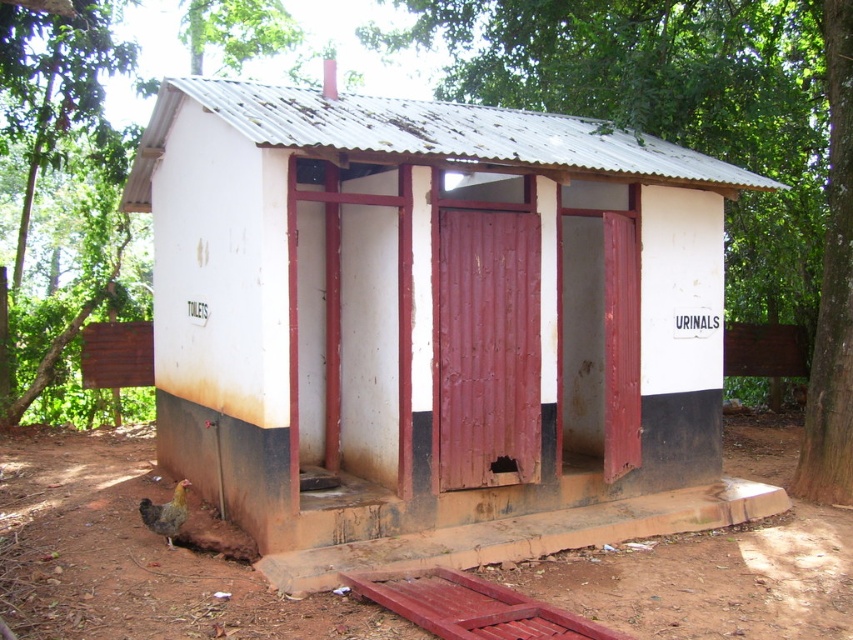
Can you confirm if white matte toilet at center is positioned above green leafy tree at center?

No.

The height and width of the screenshot is (640, 853). In order to click on white matte toilet at center in this screenshot , I will do `click(432, 321)`.

This screenshot has width=853, height=640. What are the coordinates of `white matte toilet at center` in the screenshot? It's located at (432, 321).

Can you confirm if white matte toilet at center is positioned to the left of brown feathered chicken at lower left?

No, white matte toilet at center is not to the left of brown feathered chicken at lower left.

What are the coordinates of `white matte toilet at center` in the screenshot? It's located at (432, 321).

Which is more to the left, green leafy tree at center or brown feathered chicken at lower left?

brown feathered chicken at lower left

Who is lower down, green leafy tree at center or brown feathered chicken at lower left?

Positioned lower is brown feathered chicken at lower left.

Is point (834, 417) positioned behind point (143, 499)?

Yes.

I want to click on green leafy tree at center, so click(x=703, y=140).